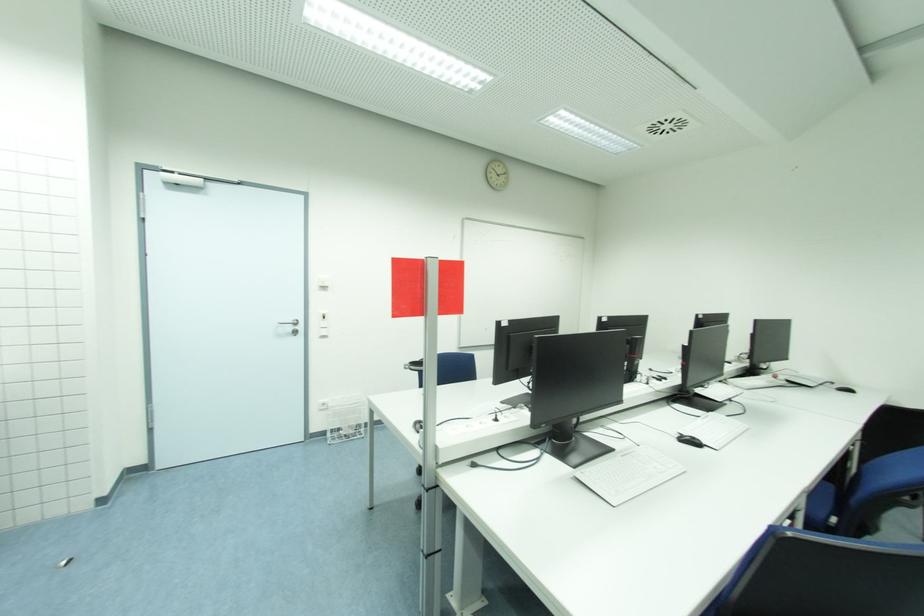
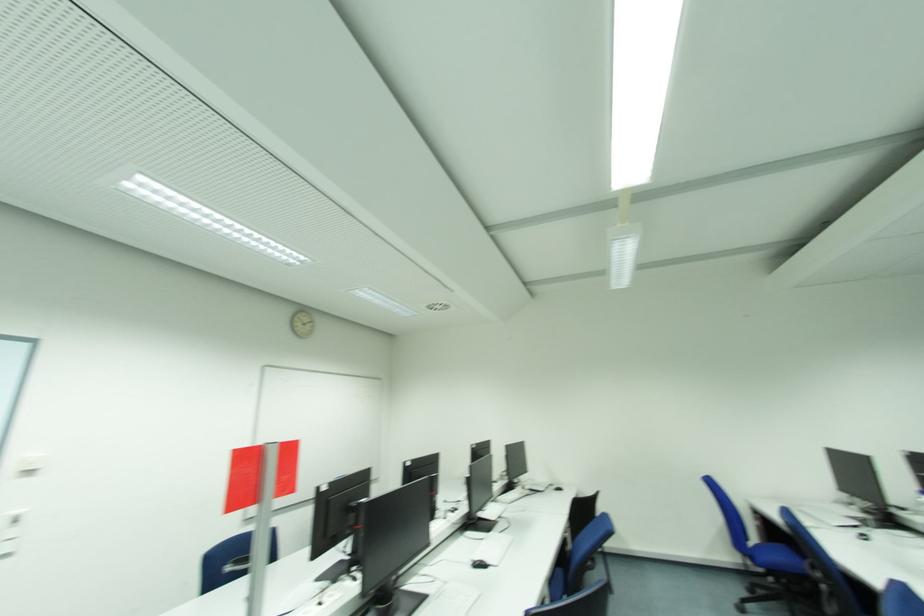
Where in the second image is the point corresponding to the point at 739,424 from the first image?

(508, 540)